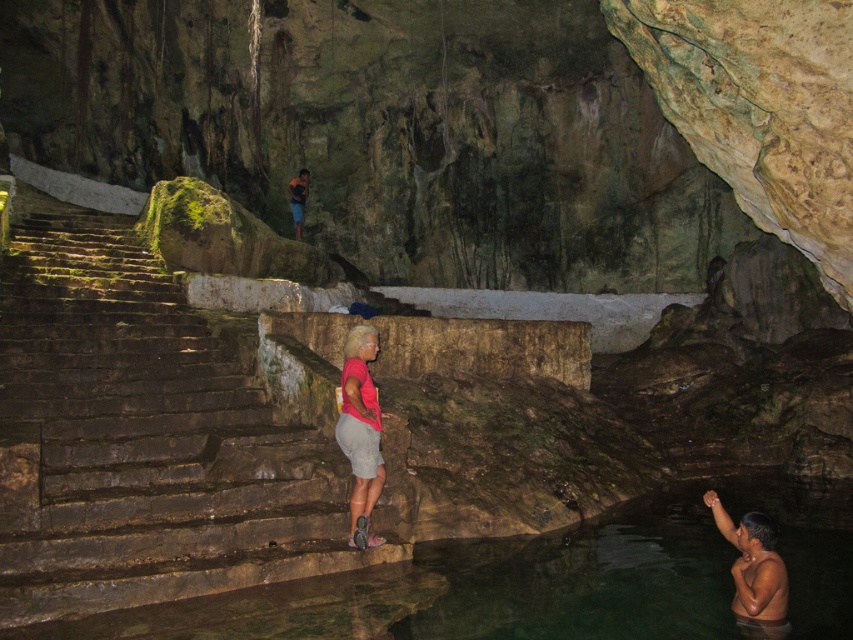
Question: Which of the following is the closest to the observer?

Choices:
 (A) (173, 349)
 (B) (711, 509)
 (C) (517, 636)

Answer: (C)

Question: From the image, what is the correct spatial relationship of pink fabric shorts at center in relation to smooth skin man at lower right?

Choices:
 (A) right
 (B) left

Answer: (B)

Question: Which of these objects is positioned farthest from the blue denim shorts at center?

Choices:
 (A) smooth skin man at lower right
 (B) pink fabric shorts at center
 (C) clear water at edge bottom
 (D) rustic stone stairs at center

Answer: (A)

Question: Estimate the real-world distances between objects in this image. Which object is closer to the smooth skin man at lower right?

Choices:
 (A) clear water at edge bottom
 (B) rustic stone stairs at center
 (C) pink fabric shorts at center
 (D) blue denim shorts at center

Answer: (A)

Question: Can you confirm if rustic stone stairs at center is bigger than clear water at edge bottom?

Choices:
 (A) yes
 (B) no

Answer: (B)

Question: Does clear water at edge bottom have a lesser width compared to smooth skin man at lower right?

Choices:
 (A) yes
 (B) no

Answer: (B)